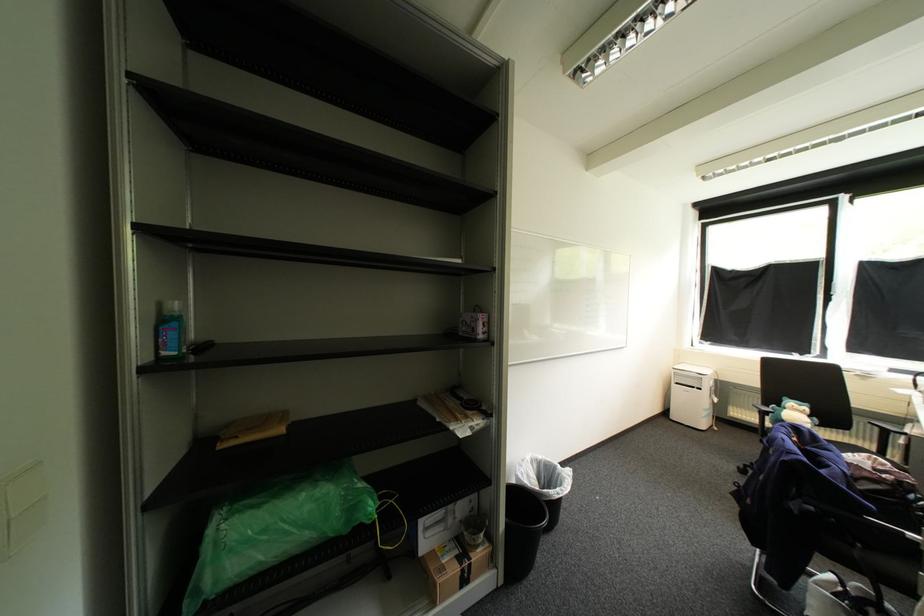
Where is `chair sitting surface`? The image size is (924, 616). chair sitting surface is located at coordinates (893, 501).